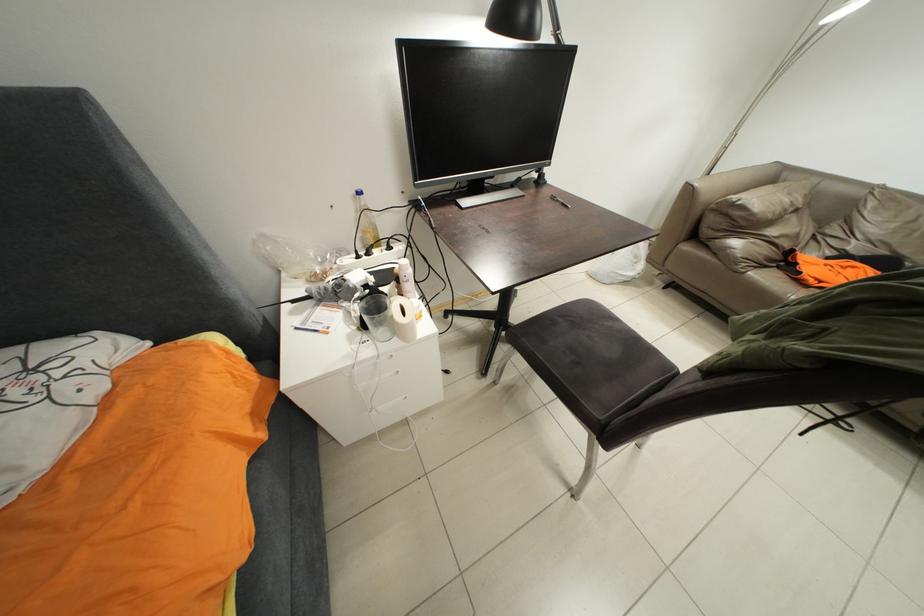
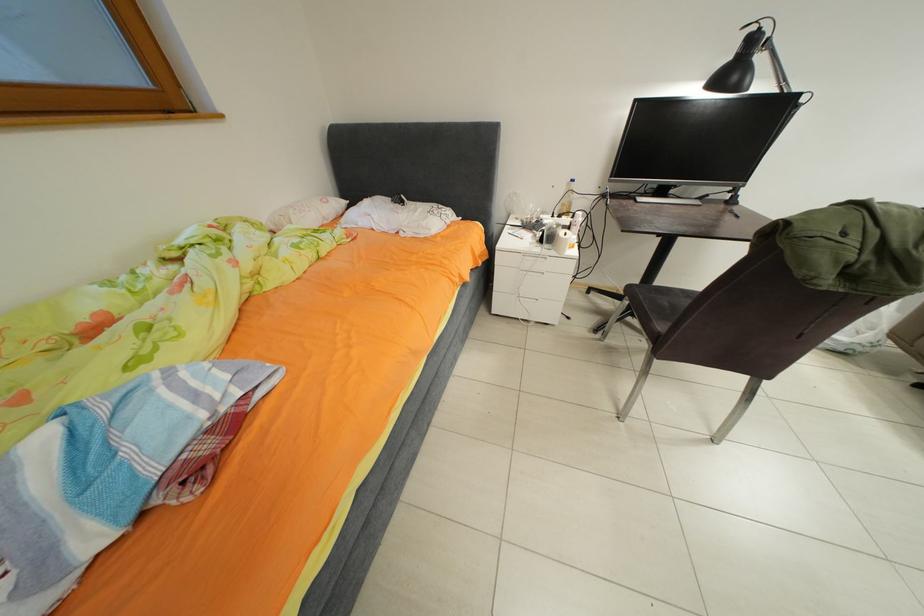
Question: The camera is either moving clockwise (left) or counter-clockwise (right) around the object. The first image is from the beginning of the video and the second image is from the end. Is the camera moving left or right when shooting the video?

Choices:
 (A) Left
 (B) Right

Answer: (B)